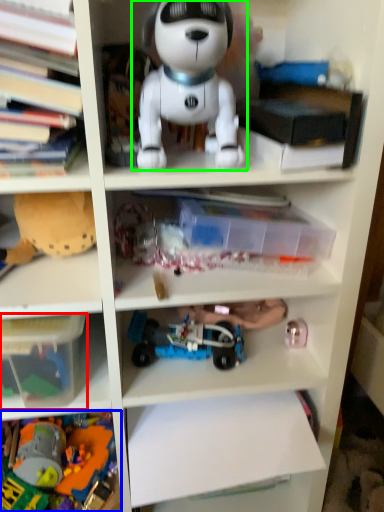
Question: Estimate the real-world distances between objects in this image. Which object is closer to storage box (highlighted by a red box), toy (highlighted by a blue box) or toy (highlighted by a green box)?

Choices:
 (A) toy
 (B) toy

Answer: (A)